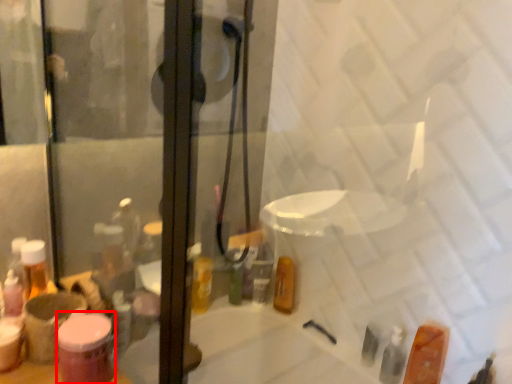
Question: From the image's perspective, what is the correct spatial positioning of toiletry (annotated by the red box) in reference to toiletry?

Choices:
 (A) above
 (B) below

Answer: (A)